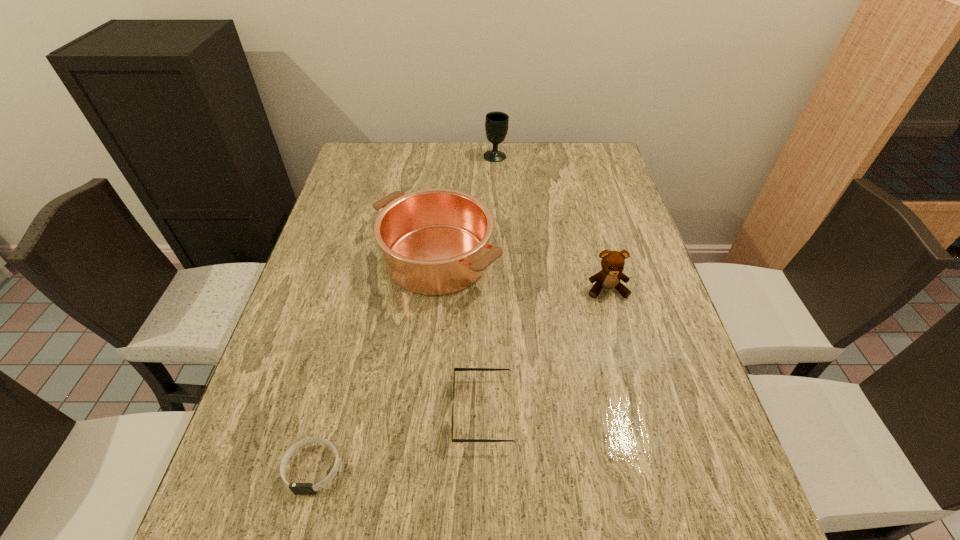
The width and height of the screenshot is (960, 540). Identify the location of vacant space that satisfies the following two spatial constraints: 1. on the front-facing side of the fourth tallest object; 2. on the outer surface of the shortest object. (483, 468).